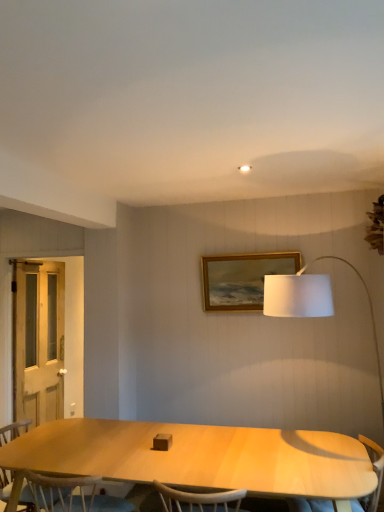
This screenshot has height=512, width=384. Describe the element at coordinates (377, 477) in the screenshot. I see `light wood armchair at lower right` at that location.

Where is `gold wooden picture frame at upper center`? gold wooden picture frame at upper center is located at coordinates (242, 278).

Based on the photo, can you tell me how much gold wooden picture frame at upper center and light wood armchair at lower right differ in facing direction?

The angular difference between gold wooden picture frame at upper center and light wood armchair at lower right is 90 degrees.

From the image's perspective, is gold wooden picture frame at upper center positioned above or below light wood armchair at lower right?

gold wooden picture frame at upper center is situated higher than light wood armchair at lower right in the image.

Does gold wooden picture frame at upper center turn towards light wood armchair at lower right?

No, gold wooden picture frame at upper center is not turned towards light wood armchair at lower right.

Considering their positions, is gold wooden picture frame at upper center located in front of or behind light brown wood chair at lower left?

In the image, gold wooden picture frame at upper center appears behind light brown wood chair at lower left.

Between gold wooden picture frame at upper center and light brown wood chair at lower left, which one has less height?

Standing shorter between the two is gold wooden picture frame at upper center.

Is light brown wood chair at lower left at the back of gold wooden picture frame at upper center?

No.

Based on the photo, which is more to the right, gold wooden picture frame at upper center or light brown wood chair at lower left?

Positioned to the right is gold wooden picture frame at upper center.

Is white wooden screen door at left bigger or smaller than light brown wood chair at lower left?

white wooden screen door at left is smaller than light brown wood chair at lower left.

Is white wooden screen door at left positioned in front of light brown wood chair at lower left?

No, it is not.

Is white wooden screen door at left taller than light brown wood chair at lower left?

Yes, white wooden screen door at left is taller than light brown wood chair at lower left.

Considering the relative positions of light wood armchair at lower right and white wooden screen door at left in the image provided, is light wood armchair at lower right to the right of white wooden screen door at left from the viewer's perspective?

Yes, light wood armchair at lower right is to the right of white wooden screen door at left.

In the image, is light wood armchair at lower right positioned in front of or behind white wooden screen door at left?

Visually, light wood armchair at lower right is located in front of white wooden screen door at left.

Identify the location of screen door above the light wood armchair at lower right (from the image's perspective). (39, 341).

Is white wooden screen door at left at the back of gold wooden picture frame at upper center?

gold wooden picture frame at upper center does not have its back to white wooden screen door at left.

Is gold wooden picture frame at upper center in contact with white wooden screen door at left?

gold wooden picture frame at upper center and white wooden screen door at left are clearly separated.

Is gold wooden picture frame at upper center outside of white wooden screen door at left?

Yes, gold wooden picture frame at upper center is outside of white wooden screen door at left.

Between gold wooden picture frame at upper center and white wooden screen door at left, which one has larger size?

white wooden screen door at left.

Is white wooden screen door at left facing away from gold wooden picture frame at upper center?

white wooden screen door at left does not have its back to gold wooden picture frame at upper center.

Which object is positioned more to the right, white wooden screen door at left or gold wooden picture frame at upper center?

From the viewer's perspective, gold wooden picture frame at upper center appears more on the right side.

Is point (42, 330) positioned behind point (256, 271)?

That is True.

Is gold wooden picture frame at upper center located within white wooden screen door at left?

No, gold wooden picture frame at upper center is not surrounded by white wooden screen door at left.

Which is farther from the camera, (8, 472) or (53, 285)?

The point (53, 285) is behind.

Identify the location of chair on the right side of white wooden screen door at left. (7, 484).

From a real-world perspective, is light brown wood chair at lower left physically above white wooden screen door at left?

Actually, light brown wood chair at lower left is physically below white wooden screen door at left in the real world.

Locate an element on the screen. Image resolution: width=384 pixels, height=512 pixels. armchair lying below the gold wooden picture frame at upper center (from the image's perspective) is located at coordinates (377, 477).

Image resolution: width=384 pixels, height=512 pixels. Identify the location of picture frame above the light brown wood chair at lower left (from a real-world perspective). (242, 278).

Based on their spatial positions, is light brown wood chair at lower left or gold wooden picture frame at upper center further from light wood armchair at lower right?

light brown wood chair at lower left lies further to light wood armchair at lower right than the other object.

Based on their spatial positions, is light wood armchair at lower right or gold wooden picture frame at upper center further from white wooden screen door at left?

The object further to white wooden screen door at left is light wood armchair at lower right.

Consider the image. From the image, which object appears to be farther from light wood armchair at lower right, gold wooden picture frame at upper center or light brown wood chair at lower left?

The object further to light wood armchair at lower right is light brown wood chair at lower left.

When comparing their distances from light wood armchair at lower right, does gold wooden picture frame at upper center or white wooden screen door at left seem further?

Among the two, white wooden screen door at left is located further to light wood armchair at lower right.

Which object lies further to the anchor point white wooden screen door at left, gold wooden picture frame at upper center or light wood armchair at lower right?

light wood armchair at lower right is further to white wooden screen door at left.

Which object lies nearer to the anchor point white wooden screen door at left, gold wooden picture frame at upper center or light brown wood chair at lower left?

Among the two, light brown wood chair at lower left is located nearer to white wooden screen door at left.

Consider the image. Which object lies nearer to the anchor point light wood armchair at lower right, white wooden screen door at left or gold wooden picture frame at upper center?

Based on the image, gold wooden picture frame at upper center appears to be nearer to light wood armchair at lower right.

From the image, which object appears to be farther from light brown wood chair at lower left, white wooden screen door at left or gold wooden picture frame at upper center?

gold wooden picture frame at upper center.

This screenshot has height=512, width=384. Identify the location of picture frame located between light brown wood chair at lower left and light wood armchair at lower right in the left-right direction. (242, 278).

Image resolution: width=384 pixels, height=512 pixels. Find the location of `chair located between white wooden screen door at left and gold wooden picture frame at upper center in the left-right direction`. chair located between white wooden screen door at left and gold wooden picture frame at upper center in the left-right direction is located at coordinates (7, 484).

Where is `picture frame between white wooden screen door at left and light wood armchair at lower right from left to right`? Image resolution: width=384 pixels, height=512 pixels. picture frame between white wooden screen door at left and light wood armchair at lower right from left to right is located at coordinates (242, 278).

Identify the location of chair situated between white wooden screen door at left and light wood armchair at lower right from left to right. (7, 484).